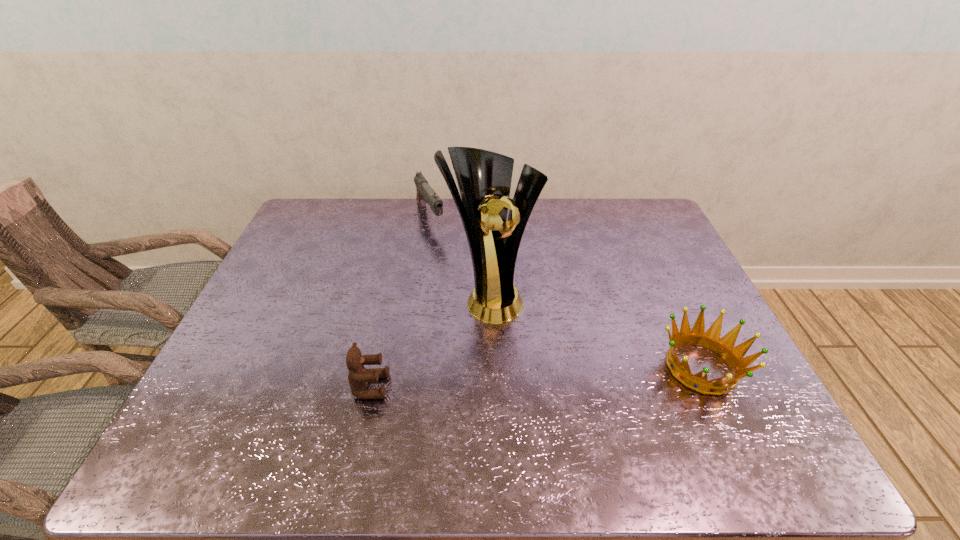
Find the location of a particular element. This screenshot has height=540, width=960. vacant space on the desktop that is between the teddy bear and the crown and is positioned in the direction the farthest object is aimed is located at coordinates (537, 376).

Identify the location of free space on the desktop that is between the teddy bear and the shortest object and is positioned at the front of the award, where the globe is visible. This screenshot has height=540, width=960. (548, 376).